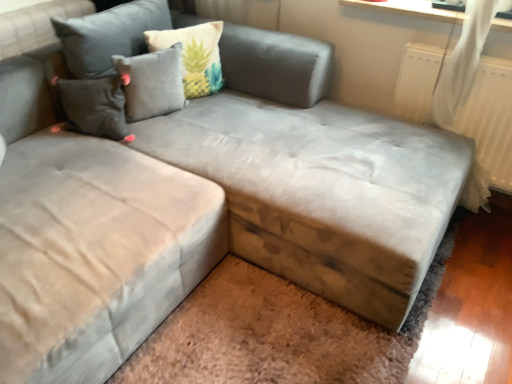
Locate an element on the screen. brown wood storage at lower right is located at coordinates (278, 332).

In order to face brown wood storage at lower right, should I rotate leftwards or rightwards?

A 6.632 degree turn to the right will do.

This screenshot has height=384, width=512. What do you see at coordinates (152, 83) in the screenshot?
I see `gray fabric pillow at upper center, which is the first pillow in left-to-right order` at bounding box center [152, 83].

This screenshot has width=512, height=384. What are the coordinates of `gray fabric pillow at upper center, which is the first pillow in left-to-right order` in the screenshot? It's located at (152, 83).

At what (x,y) coordinates should I click in order to perform the action: click on brown wood storage at lower right. Please return your answer as a coordinate pair (x, y). Looking at the image, I should click on (278, 332).

Where is `pillow in front of the beige fabric pillow at upper center, which is counted as the second pillow, starting from the left`? The width and height of the screenshot is (512, 384). pillow in front of the beige fabric pillow at upper center, which is counted as the second pillow, starting from the left is located at coordinates (152, 83).

Is the depth of gray fabric pillow at upper center, which is the first pillow in left-to-right order, less than that of beige fabric pillow at upper center, which is counted as the second pillow, starting from the left?

Yes, it is.

Does gray fabric pillow at upper center, which is the first pillow in left-to-right order, turn towards beige fabric pillow at upper center, acting as the 1th pillow starting from the right?

No, gray fabric pillow at upper center, which is the first pillow in left-to-right order, is not aimed at beige fabric pillow at upper center, acting as the 1th pillow starting from the right.

Would you say beige fabric pillow at upper center, acting as the 1th pillow starting from the right, is inside or outside brown wood storage at lower right?

beige fabric pillow at upper center, acting as the 1th pillow starting from the right, is outside brown wood storage at lower right.

Which object is closer to the camera, beige fabric pillow at upper center, which is counted as the second pillow, starting from the left, or brown wood storage at lower right?

brown wood storage at lower right.

Does beige fabric pillow at upper center, which is counted as the second pillow, starting from the left, appear on the right side of brown wood storage at lower right?

No.

Is beige fabric pillow at upper center, acting as the 1th pillow starting from the right, oriented towards brown wood storage at lower right?

No, beige fabric pillow at upper center, acting as the 1th pillow starting from the right, does not turn towards brown wood storage at lower right.

Is brown wood storage at lower right to the left of beige fabric pillow at upper center, acting as the 1th pillow starting from the right, from the viewer's perspective?

Incorrect, brown wood storage at lower right is not on the left side of beige fabric pillow at upper center, acting as the 1th pillow starting from the right.

Does brown wood storage at lower right touch beige fabric pillow at upper center, which is counted as the second pillow, starting from the left?

No, brown wood storage at lower right is not touching beige fabric pillow at upper center, which is counted as the second pillow, starting from the left.

Who is shorter, brown wood storage at lower right or beige fabric pillow at upper center, acting as the 1th pillow starting from the right?

brown wood storage at lower right.

In the scene shown: Which object is closer to the camera, brown wood storage at lower right or beige fabric pillow at upper center, acting as the 1th pillow starting from the right?

brown wood storage at lower right is in front.

Is point (228, 294) closer to viewer compared to point (177, 63)?

Yes, point (228, 294) is closer to viewer.

Is gray fabric pillow at upper center, which is the 2th pillow from right to left, at the back of brown wood storage at lower right?

That's not correct — brown wood storage at lower right is not looking away from gray fabric pillow at upper center, which is the 2th pillow from right to left.

Which of these two, brown wood storage at lower right or gray fabric pillow at upper center, which is the first pillow in left-to-right order, is smaller?

brown wood storage at lower right is smaller.

Between brown wood storage at lower right and gray fabric pillow at upper center, which is the first pillow in left-to-right order, which one appears on the right side from the viewer's perspective?

Positioned to the right is brown wood storage at lower right.

Which point is more distant from viewer, (x=175, y=105) or (x=190, y=314)?

The point (x=175, y=105) is more distant.

From the image's perspective, which one is positioned lower, gray fabric pillow at upper center, which is the 2th pillow from right to left, or brown wood storage at lower right?

brown wood storage at lower right is shown below in the image.

Between gray fabric pillow at upper center, which is the first pillow in left-to-right order, and brown wood storage at lower right, which one has less height?

brown wood storage at lower right.

Is gray fabric pillow at upper center, which is the 2th pillow from right to left, positioned far away from brown wood storage at lower right?

Yes, gray fabric pillow at upper center, which is the 2th pillow from right to left, is far from brown wood storage at lower right.

From the image's perspective, is beige fabric pillow at upper center, which is counted as the second pillow, starting from the left, located above gray fabric pillow at upper center, which is the first pillow in left-to-right order?

Correct, beige fabric pillow at upper center, which is counted as the second pillow, starting from the left, appears higher than gray fabric pillow at upper center, which is the first pillow in left-to-right order, in the image.

Does beige fabric pillow at upper center, which is counted as the second pillow, starting from the left, have a smaller size compared to gray fabric pillow at upper center, which is the first pillow in left-to-right order?

No.

Is beige fabric pillow at upper center, acting as the 1th pillow starting from the right, in front of or behind gray fabric pillow at upper center, which is the 2th pillow from right to left, in the image?

In the image, beige fabric pillow at upper center, acting as the 1th pillow starting from the right, appears behind gray fabric pillow at upper center, which is the 2th pillow from right to left.

Is beige fabric pillow at upper center, acting as the 1th pillow starting from the right, next to gray fabric pillow at upper center, which is the first pillow in left-to-right order?

beige fabric pillow at upper center, acting as the 1th pillow starting from the right, is not next to gray fabric pillow at upper center, which is the first pillow in left-to-right order, and they're not touching.

You are a GUI agent. You are given a task and a screenshot of the screen. Output one action in this format:
    pyautogui.click(x=<x>, y=<y>)
    Task: Click on the pillow positioned vertically above the gray fabric pillow at upper center, which is the 2th pillow from right to left (from a real-world perspective)
    The image size is (512, 384).
    Given the screenshot: What is the action you would take?
    pyautogui.click(x=194, y=55)

Locate an element on the screen. The image size is (512, 384). mat lying in front of the beige fabric pillow at upper center, acting as the 1th pillow starting from the right is located at coordinates (278, 332).

Based on their spatial positions, is brown wood storage at lower right or beige fabric pillow at upper center, which is counted as the second pillow, starting from the left, further from gray fabric pillow at upper center, which is the 2th pillow from right to left?

brown wood storage at lower right.

Estimate the real-world distances between objects in this image. Which object is further from brown wood storage at lower right, beige fabric pillow at upper center, which is counted as the second pillow, starting from the left, or gray fabric pillow at upper center, which is the 2th pillow from right to left?

Among the two, beige fabric pillow at upper center, which is counted as the second pillow, starting from the left, is located further to brown wood storage at lower right.

Which object lies nearer to the anchor point beige fabric pillow at upper center, acting as the 1th pillow starting from the right, gray fabric pillow at upper center, which is the first pillow in left-to-right order, or brown wood storage at lower right?

The object closer to beige fabric pillow at upper center, acting as the 1th pillow starting from the right, is gray fabric pillow at upper center, which is the first pillow in left-to-right order.

Considering their positions, is brown wood storage at lower right positioned closer to beige fabric pillow at upper center, acting as the 1th pillow starting from the right, than gray fabric pillow at upper center, which is the 2th pillow from right to left?

gray fabric pillow at upper center, which is the 2th pillow from right to left, is closer to beige fabric pillow at upper center, acting as the 1th pillow starting from the right.

Estimate the real-world distances between objects in this image. Which object is closer to gray fabric pillow at upper center, which is the first pillow in left-to-right order, beige fabric pillow at upper center, which is counted as the second pillow, starting from the left, or brown wood storage at lower right?

beige fabric pillow at upper center, which is counted as the second pillow, starting from the left.

Based on their spatial positions, is gray fabric pillow at upper center, which is the 2th pillow from right to left, or beige fabric pillow at upper center, acting as the 1th pillow starting from the right, closer to brown wood storage at lower right?

gray fabric pillow at upper center, which is the 2th pillow from right to left, is positioned closer to the anchor brown wood storage at lower right.

Locate an element on the screen. pillow between beige fabric pillow at upper center, which is counted as the second pillow, starting from the left, and brown wood storage at lower right from top to bottom is located at coordinates (152, 83).